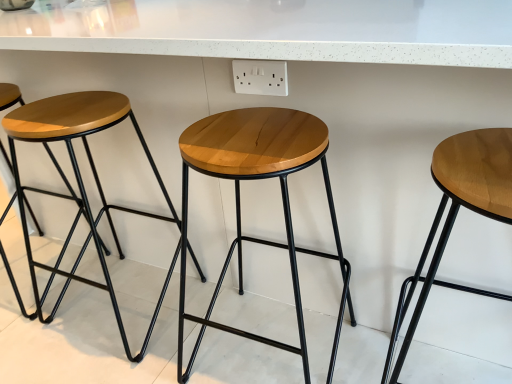
Question: From the image's perspective, is light brown wood stool at right, which is counted as the 1th stool, starting from the right, above natural wood stool at center, the 3th stool in the left-to-right sequence?

Choices:
 (A) yes
 (B) no

Answer: (B)

Question: Is light brown wood stool at right, arranged as the 4th stool when viewed from the left, positioned behind natural wood stool at center, the second stool positioned from the right?

Choices:
 (A) no
 (B) yes

Answer: (A)

Question: Does light brown wood stool at right, which is counted as the 1th stool, starting from the right, have a larger size compared to natural wood stool at center, the 3th stool in the left-to-right sequence?

Choices:
 (A) yes
 (B) no

Answer: (B)

Question: Is light brown wood stool at right, which is counted as the 1th stool, starting from the right, oriented away from natural wood stool at center, the 3th stool in the left-to-right sequence?

Choices:
 (A) yes
 (B) no

Answer: (B)

Question: From a real-world perspective, is light brown wood stool at right, arranged as the 4th stool when viewed from the left, below natural wood stool at center, the 3th stool in the left-to-right sequence?

Choices:
 (A) no
 (B) yes

Answer: (A)

Question: Is wooden stool at left, which is the 2th stool from left to right, in front of or behind light brown wood stool at right, which is counted as the 1th stool, starting from the right, in the image?

Choices:
 (A) behind
 (B) front

Answer: (A)

Question: From the image's perspective, relative to light brown wood stool at right, arranged as the 4th stool when viewed from the left, is wooden stool at left, acting as the third stool starting from the right, above or below?

Choices:
 (A) below
 (B) above

Answer: (B)

Question: Is wooden stool at left, which is the 2th stool from left to right, inside the boundaries of light brown wood stool at right, arranged as the 4th stool when viewed from the left, or outside?

Choices:
 (A) inside
 (B) outside

Answer: (B)

Question: Looking at their shapes, would you say wooden stool at left, which is the 2th stool from left to right, is wider or thinner than light brown wood stool at right, arranged as the 4th stool when viewed from the left?

Choices:
 (A) thin
 (B) wide

Answer: (A)

Question: Is matte wood stool at left, the 4th stool when ordered from right to left, inside or outside of light brown wood stool at right, which is counted as the 1th stool, starting from the right?

Choices:
 (A) inside
 (B) outside

Answer: (B)

Question: Looking at their shapes, would you say matte wood stool at left, the 4th stool when ordered from right to left, is wider or thinner than light brown wood stool at right, which is counted as the 1th stool, starting from the right?

Choices:
 (A) wide
 (B) thin

Answer: (B)

Question: From their relative heights in the image, would you say matte wood stool at left, the first stool positioned from the left, is taller or shorter than light brown wood stool at right, arranged as the 4th stool when viewed from the left?

Choices:
 (A) tall
 (B) short

Answer: (A)

Question: Considering the positions of matte wood stool at left, the 4th stool when ordered from right to left, and light brown wood stool at right, arranged as the 4th stool when viewed from the left, in the image, is matte wood stool at left, the 4th stool when ordered from right to left, bigger or smaller than light brown wood stool at right, arranged as the 4th stool when viewed from the left,?

Choices:
 (A) big
 (B) small

Answer: (A)

Question: Is matte wood stool at left, the first stool positioned from the left, taller or shorter than natural wood stool at center, the 3th stool in the left-to-right sequence?

Choices:
 (A) tall
 (B) short

Answer: (A)

Question: Is point (x=78, y=198) positioned closer to the camera than point (x=228, y=332)?

Choices:
 (A) closer
 (B) farther

Answer: (B)